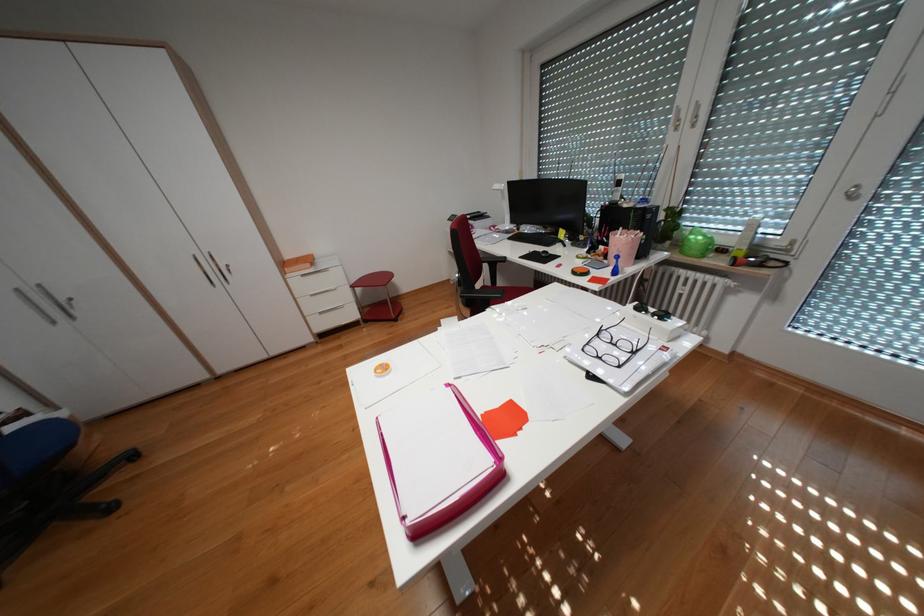
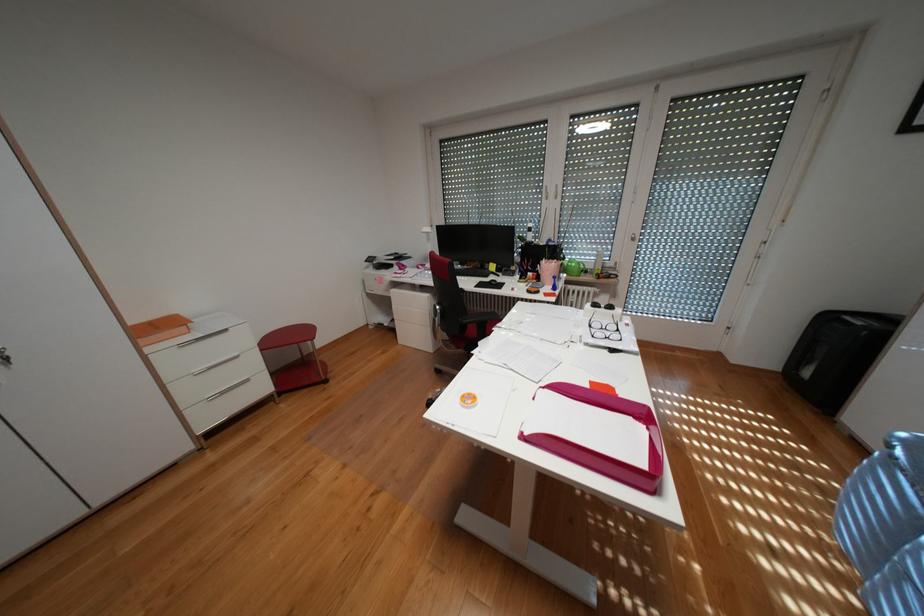
Locate, in the second image, the point that corresponds to point 365,314 in the first image.

(274, 387)